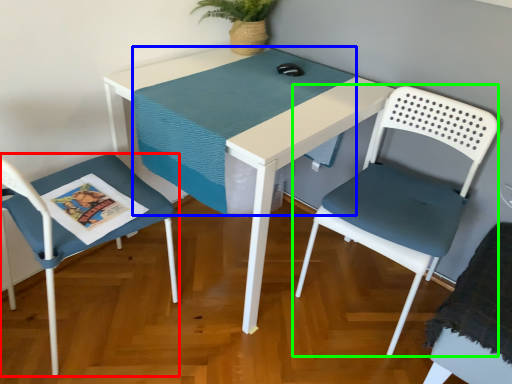
Question: Considering the real-world distances, which object is closest to chair (highlighted by a red box)? table top (highlighted by a blue box) or chair (highlighted by a green box).

Choices:
 (A) table top
 (B) chair

Answer: (A)